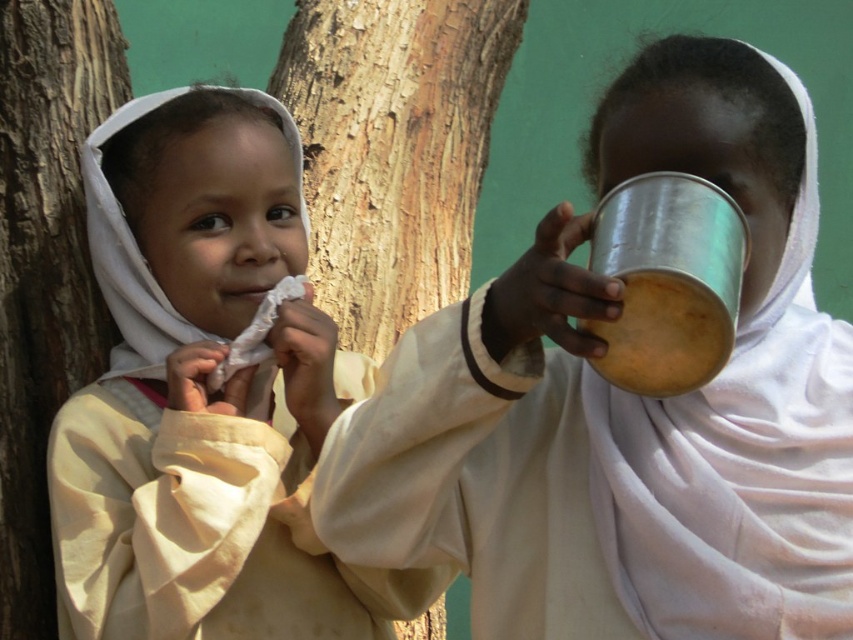
Is metallic cup at right bigger than light beige cloth at left?

Correct, metallic cup at right is larger in size than light beige cloth at left.

Who is more distant from viewer, (372,476) or (126,433)?

The point (126,433) is behind.

Describe the element at coordinates (625, 406) in the screenshot. I see `metallic cup at right` at that location.

Find the location of a particular element. The image size is (853, 640). metallic cup at right is located at coordinates (625, 406).

Does metallic cup at right have a greater width compared to smooth brown bark at left?

Indeed, metallic cup at right has a greater width compared to smooth brown bark at left.

Locate an element on the screen. This screenshot has width=853, height=640. metallic cup at right is located at coordinates (625, 406).

At what (x,y) coordinates should I click in order to perform the action: click on metallic cup at right. Please return your answer as a coordinate pair (x, y). Looking at the image, I should click on (625, 406).

Which is in front, point (682, 412) or point (4, 243)?

Positioned in front is point (682, 412).

Can you confirm if metallic cup at right is smaller than rough bark tree at left?

No.

Is point (751, 83) closer to viewer compared to point (71, 140)?

Yes, point (751, 83) is closer to viewer.

This screenshot has height=640, width=853. Identify the location of metallic cup at right. (625, 406).